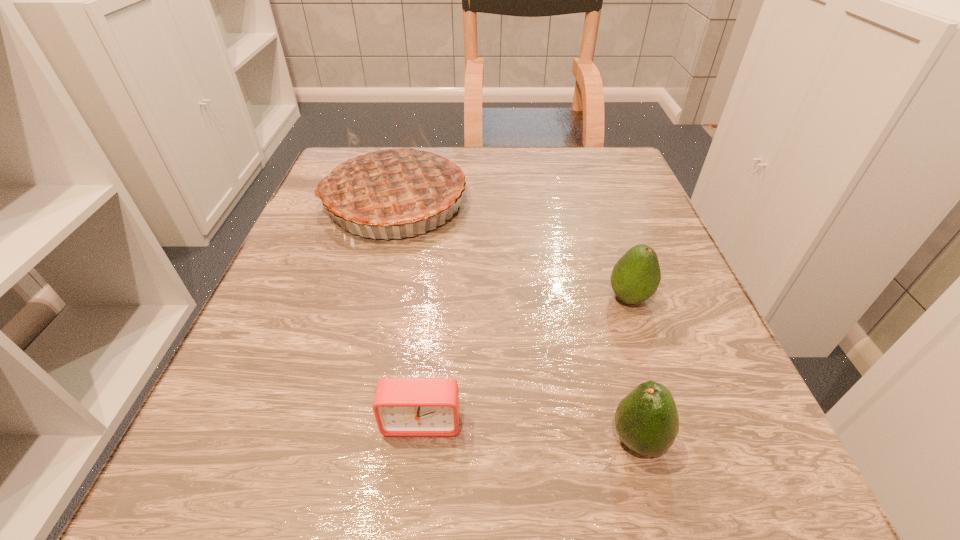
The image size is (960, 540). Identify the location of object that is at the near edge. (647, 422).

Where is `object at the left edge`? This screenshot has width=960, height=540. object at the left edge is located at coordinates (393, 185).

Locate an element on the screen. Image resolution: width=960 pixels, height=540 pixels. object positioned at the far left corner is located at coordinates (393, 185).

Identify the location of object located at the near right corner. The image size is (960, 540). (647, 422).

Where is `vacant space at the far edge of the desktop`? The image size is (960, 540). vacant space at the far edge of the desktop is located at coordinates (506, 147).

At what (x,y) coordinates should I click in order to perform the action: click on blank space at the near edge. Please return your answer as a coordinate pair (x, y). Looking at the image, I should click on (639, 479).

The height and width of the screenshot is (540, 960). In the image, there is a desktop. What are the coordinates of `vacant space at the left edge` in the screenshot? It's located at (262, 372).

Identify the location of vacant space at the right edge of the desktop. (636, 362).

This screenshot has width=960, height=540. Identify the location of free location at the far right corner of the desktop. (630, 178).

The image size is (960, 540). Identify the location of vacant space in between the shortest object and the third nearest object. (525, 360).